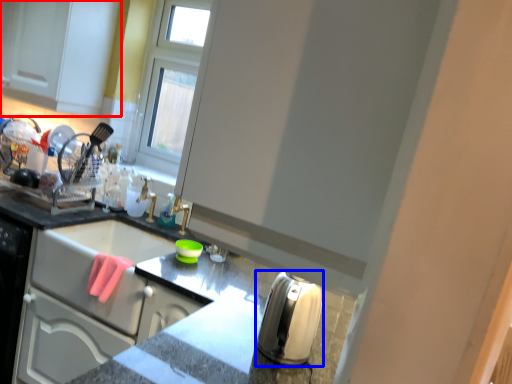
Question: Which object is further to the camera taking this photo, cabinetry (highlighted by a red box) or appliance (highlighted by a blue box)?

Choices:
 (A) cabinetry
 (B) appliance

Answer: (A)